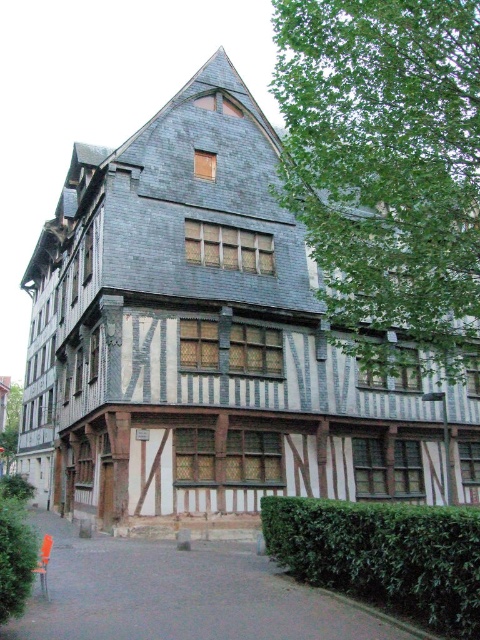
You are standing in front of the historic building and want to take a photo that includes both the building and the green leafy hedge at lower right. Considering the distance of the hedge, will you need to zoom out your camera lens to ensure both are in frame?

The green leafy hedge at lower right is 16.03 meters away from the camera. Since the hedge is relatively far from the camera, you would need to zoom out to capture both the historic building in the foreground and the hedge in the background within the same frame.

You are standing at the entrance of the historic building and want to find the green leafy hedge at lower right. According to the scene description, where should you look relative to the building?

The green leafy hedge at lower right is located at point [384,556], which is to the lower right side of the building. You should look towards the lower right direction from the entrance to find it.

You are a gardener standing in the middle of the street in front of the historic building. You need to water both the green leafy hedge at lower right and the green leafy hedge at lower left. Which hedge is farther from your current position?

The green leafy hedge at lower right is 9.88 meters away from the green leafy hedge at lower left. Since you are standing in the middle, the distance to each hedge would depend on their positions. However, the description states the distance between them is 9.88 meters, so if they are aligned symmetrically, both would be equidistant from the center. But since the question asks which is farther, perhaps there is an asymmetry. Wait, the problem states the distance between the two hedges is 9.88 meters. If you